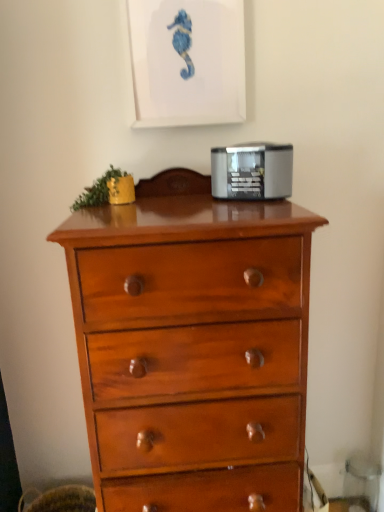
Question: Relative to shiny wood chest of drawers at center, is matte white picture frame at upper center in front or behind?

Choices:
 (A) front
 (B) behind

Answer: (B)

Question: Based on their positions, is matte white picture frame at upper center located to the left or right of shiny wood chest of drawers at center?

Choices:
 (A) left
 (B) right

Answer: (A)

Question: Based on their relative distances, which object is nearer to the matte white picture frame at upper center?

Choices:
 (A) shiny wood chest of drawers at center
 (B) satin silver toaster at upper center

Answer: (B)

Question: Which of these objects is positioned farthest from the shiny wood chest of drawers at center?

Choices:
 (A) matte white picture frame at upper center
 (B) satin silver toaster at upper center

Answer: (A)